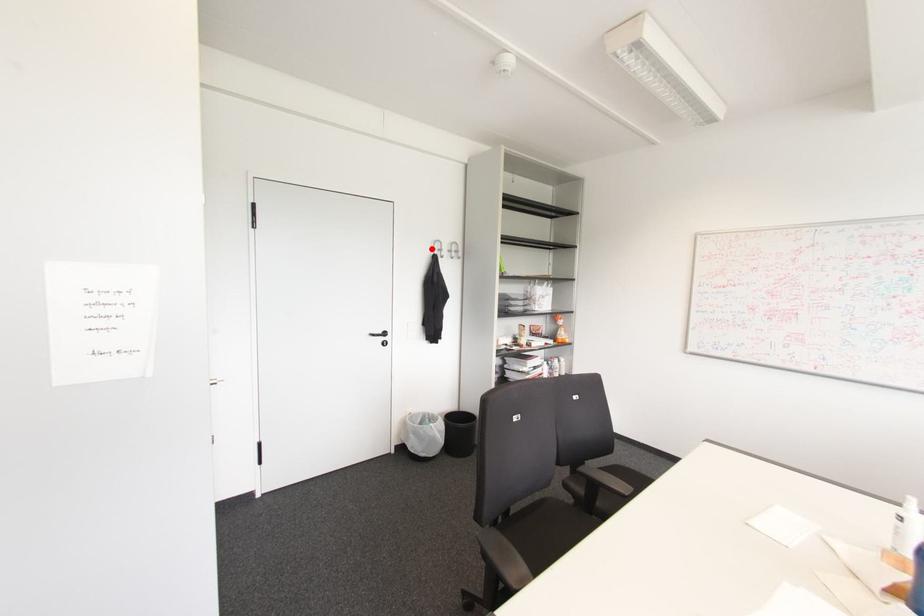
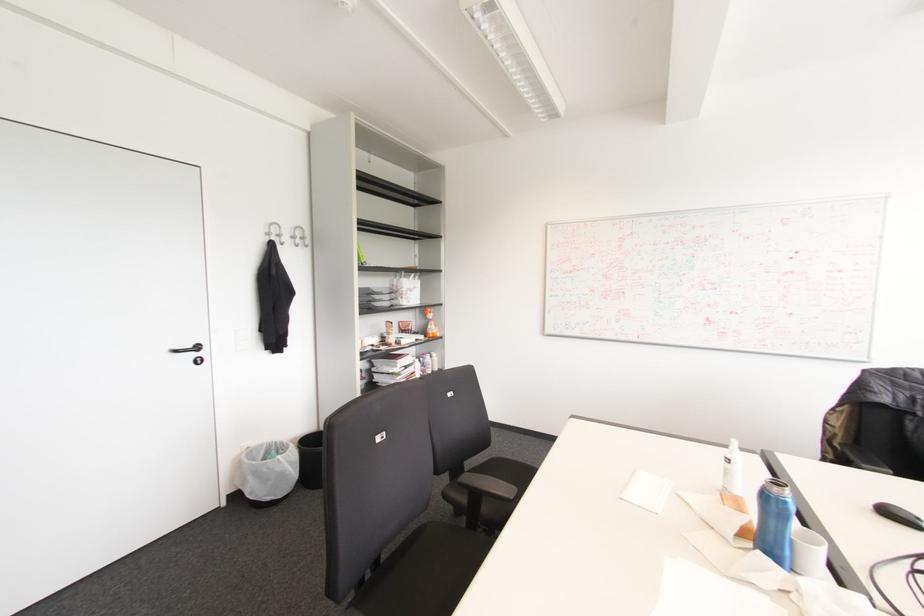
Locate, in the second image, the point that corresponds to the highlighted location in the first image.

(266, 233)